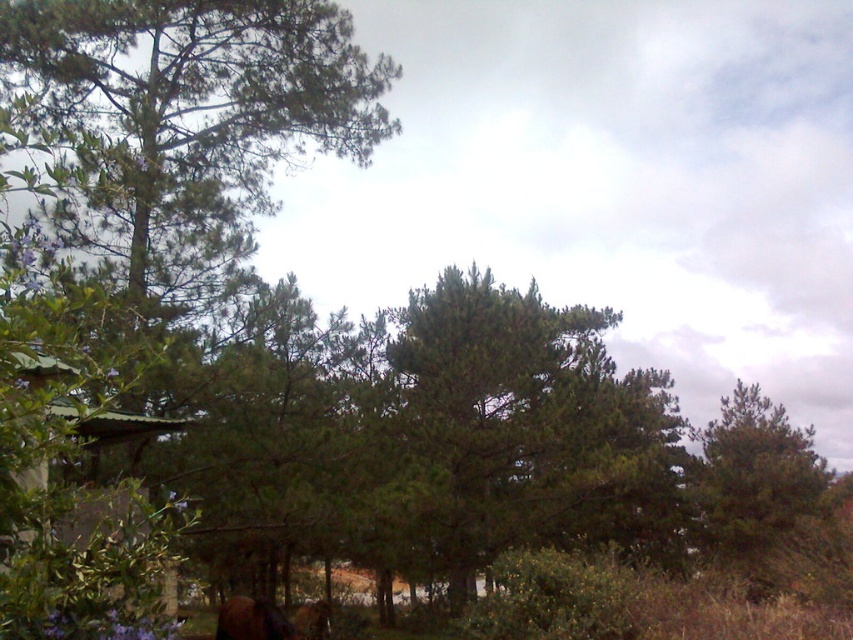
Question: In this image, where is green matte tree at center located relative to green corrugated metal hut at lower left?

Choices:
 (A) above
 (B) below

Answer: (B)

Question: Which point is farther to the camera?

Choices:
 (A) brown fuzzy horse at lower left
 (B) green matte tree at center
 (C) green corrugated metal hut at lower left

Answer: (B)

Question: Does green corrugated metal hut at lower left appear on the right side of brown fuzzy horse at lower left?

Choices:
 (A) no
 (B) yes

Answer: (B)

Question: Can you confirm if green matte tree at center is bigger than brown fuzzy horse at lower left?

Choices:
 (A) no
 (B) yes

Answer: (B)

Question: Estimate the real-world distances between objects in this image. Which object is closer to the brown furry dog at lower center?

Choices:
 (A) green matte tree at center
 (B) green corrugated metal hut at lower left

Answer: (B)

Question: Which of these objects is positioned closest to the green matte tree at center?

Choices:
 (A) green corrugated metal hut at lower left
 (B) brown fuzzy horse at lower left
 (C) brown furry dog at lower center

Answer: (C)